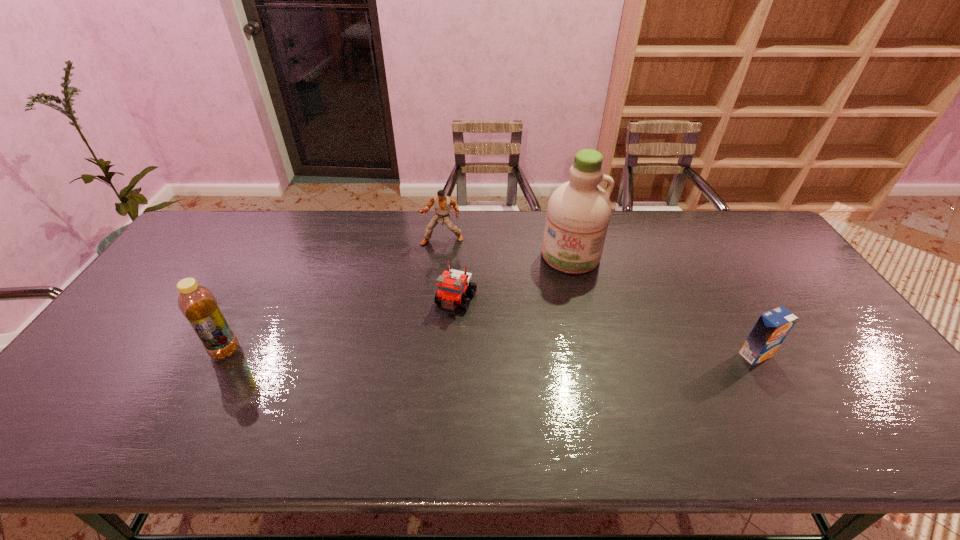
The height and width of the screenshot is (540, 960). I want to click on free spot on the desktop that is between the leftmost object and the rightmost object and is positioned on the front label of the tallest object, so click(561, 353).

Find the location of a particular element. The image size is (960, 540). vacant spot on the desktop that is between the leftmost object and the rightmost object and is positioned on the front-facing side of the puncher is located at coordinates (425, 352).

I want to click on vacant space on the desktop that is between the bottle and the orange_juice and is positioned on the front-facing side of the shortest object, so click(x=429, y=352).